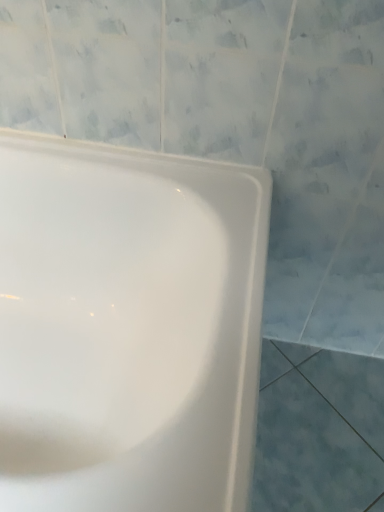
This screenshot has height=512, width=384. What do you see at coordinates (127, 327) in the screenshot?
I see `white glossy bathtub at upper left` at bounding box center [127, 327].

Find the location of `white glossy bathtub at upper left`. white glossy bathtub at upper left is located at coordinates (127, 327).

This screenshot has height=512, width=384. What are the coordinates of `white glossy bathtub at upper left` in the screenshot? It's located at [x=127, y=327].